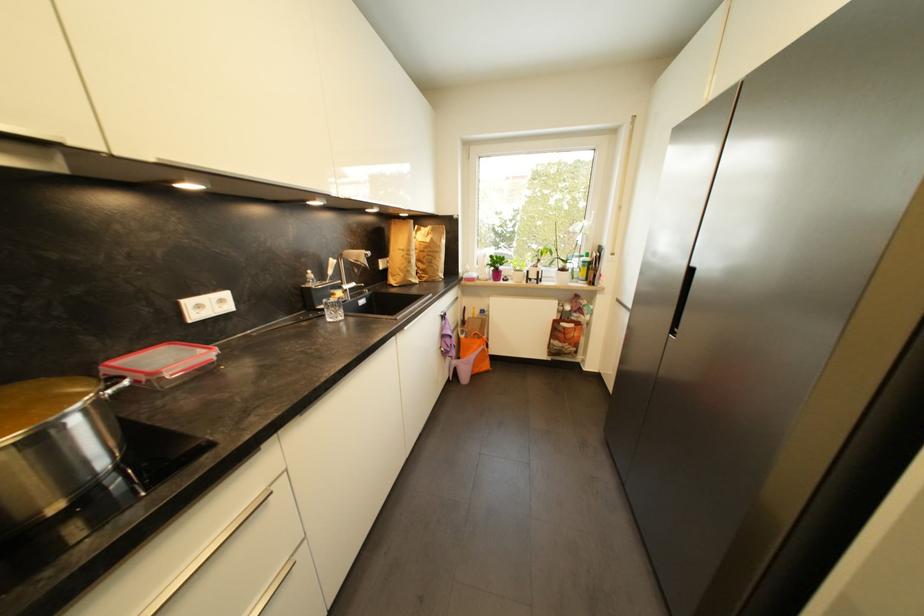
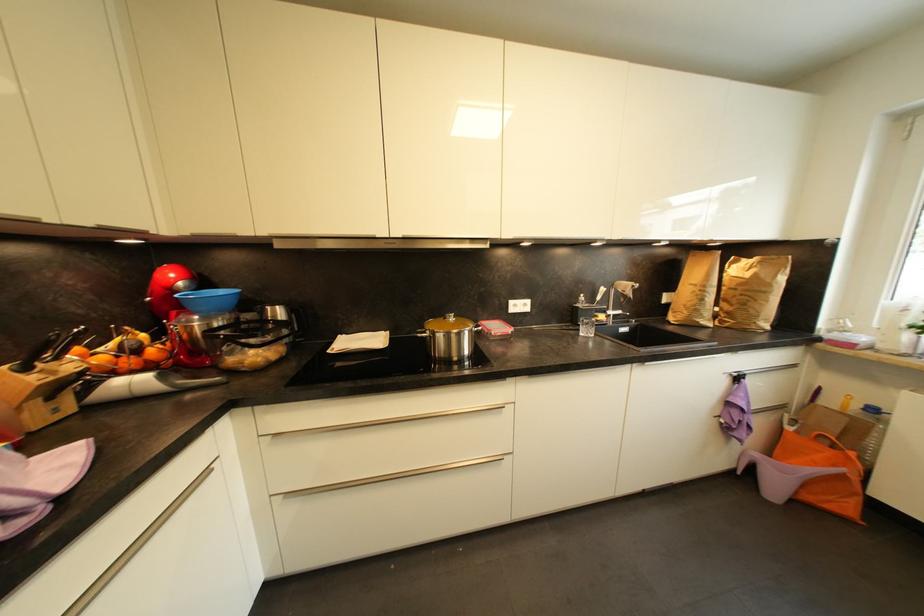
Question: The images are taken continuously from a first-person perspective. In which direction is your viewpoint rotating?

Choices:
 (A) Left
 (B) Right
 (C) Up
 (D) Down

Answer: (A)